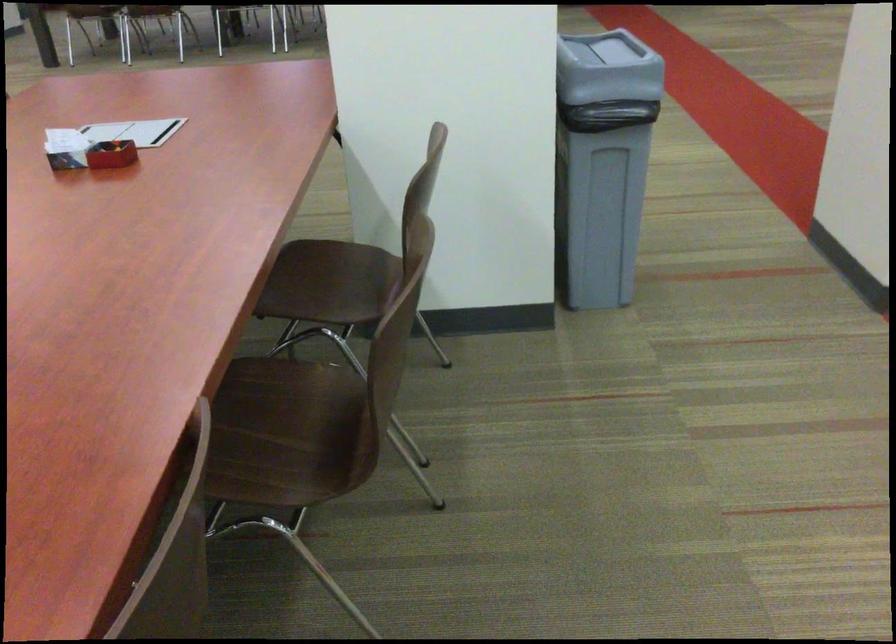
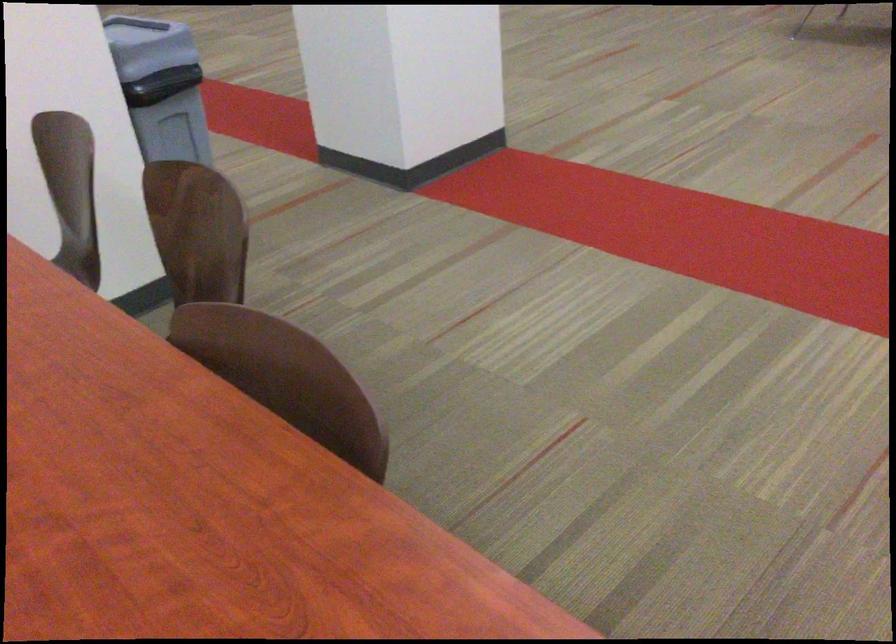
Question: The camera is either moving clockwise (left) or counter-clockwise (right) around the object. The first image is from the beginning of the video and the second image is from the end. Is the camera moving left or right when shooting the video?

Choices:
 (A) Left
 (B) Right

Answer: (A)